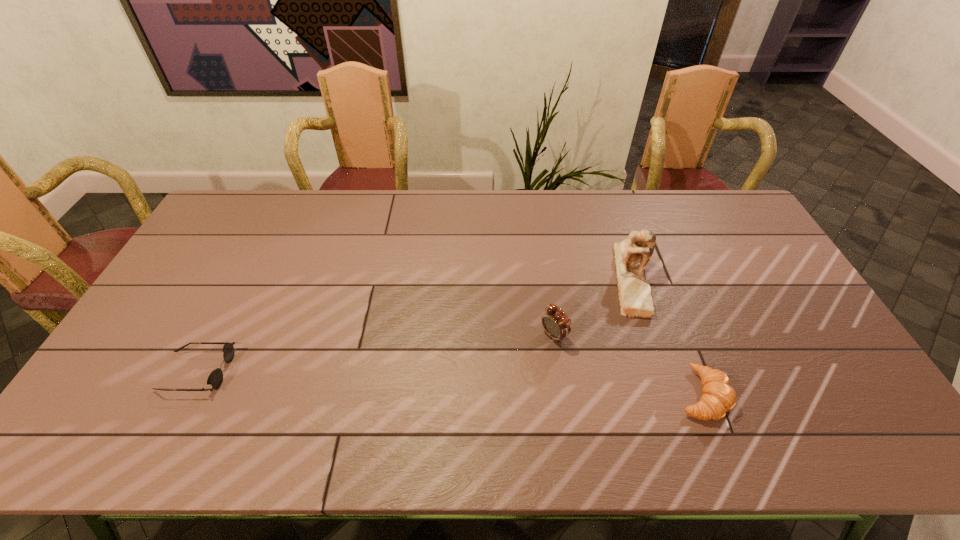
This screenshot has width=960, height=540. I want to click on the shortest object, so click(215, 379).

Find the location of a particular element. Image resolution: width=960 pixels, height=540 pixels. sunglasses is located at coordinates (215, 379).

You are a GUI agent. You are given a task and a screenshot of the screen. Output one action in this format:
    pyautogui.click(x=<x>, y=<y>)
    Task: Click on the crescent roll
    
    Given the screenshot: What is the action you would take?
    pyautogui.click(x=718, y=397)

Locate an element on the screen. the third nearest object is located at coordinates (557, 325).

At what (x,y) coordinates should I click in order to perform the action: click on alarm clock. Please return your answer as a coordinate pair (x, y). The image size is (960, 540). Looking at the image, I should click on (557, 325).

Image resolution: width=960 pixels, height=540 pixels. Identify the location of the farthest object. (631, 255).

I want to click on figurine, so click(631, 255).

Locate an element on the screen. This screenshot has height=540, width=960. vacant space situated on the front-facing side of the leftmost object is located at coordinates (301, 372).

Locate an element on the screen. Image resolution: width=960 pixels, height=540 pixels. free space located on the right of the third tallest object is located at coordinates (747, 394).

Where is `free space located on the face of the second tallest object`? This screenshot has height=540, width=960. free space located on the face of the second tallest object is located at coordinates (519, 359).